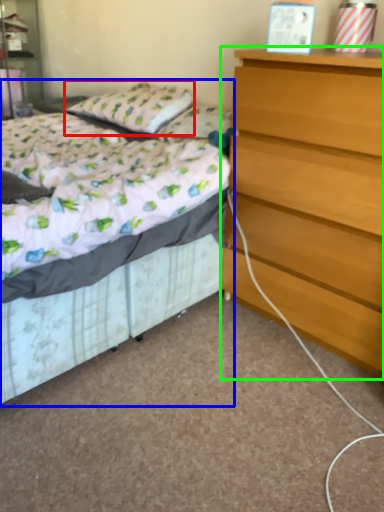
Question: Which is farther away from pillow (highlighted by a red box)? bed (highlighted by a blue box) or chest of drawers (highlighted by a green box)?

Choices:
 (A) bed
 (B) chest of drawers

Answer: (B)